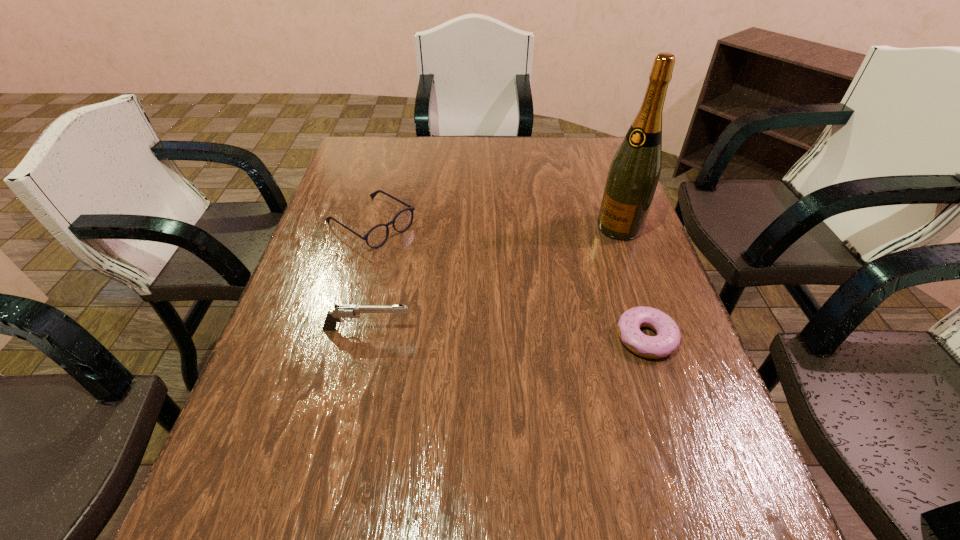
Where is `object identified as the third closest to the pistol`? This screenshot has height=540, width=960. object identified as the third closest to the pistol is located at coordinates (632, 179).

At what (x,y) coordinates should I click in order to perform the action: click on object that ranks as the closest to the wine bottle. Please return your answer as a coordinate pair (x, y). Looking at the image, I should click on (668, 337).

Find the location of a particular element. free spot that satisfies the following two spatial constraints: 1. on the front side of the second shortest object; 2. on the front-facing side of the second tallest object is located at coordinates (342, 329).